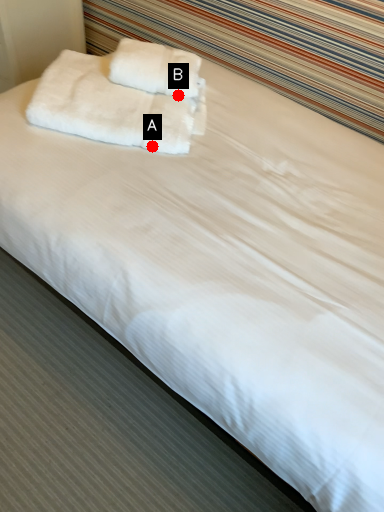
Question: Two points are circled on the image, labeled by A and B beside each circle. Which point is closer to the camera?

Choices:
 (A) A is closer
 (B) B is closer

Answer: (A)